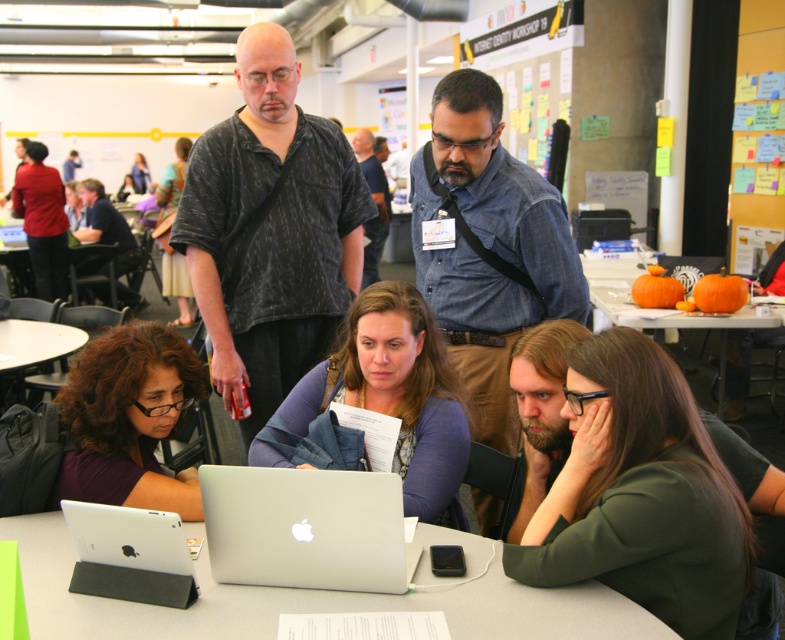
Based on the photo, you are a photographer standing behind the group and want to capture a photo of the dark blue shirt at center and the white matte tablet at lower left. Which object is closer to the camera?

The dark blue shirt at center is closer to the camera because it is taller than the white matte tablet at lower left.

You are a photographer standing behind the group of people at the table. You want to take a photo of the dark blue shirt at center without the white matte tablet at lower left blocking it. Is this possible?

The white matte tablet at lower left is closer to the viewer than the dark blue shirt at center, so the tablet would block the view of the dark blue shirt at center. Therefore, it is not possible to take a photo of the dark blue shirt at center without the tablet blocking it.

You are standing at the center of the image and want to place a new sticky note exactly 0.1 units to the right of the yellow sticky notes at upper right. What are the coordinates of the new sticky note?

The coordinates of the new sticky note would be approximately 0.058 plus 0.1 equals 0.158 in the x direction, and 0.969 in the y direction, so the new coordinates are approximately (760, 100).